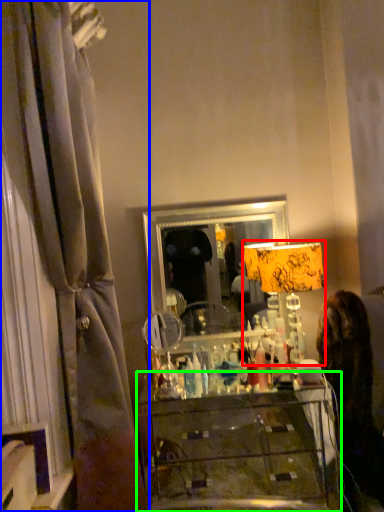
Question: Which object is positioned closest to table lamp (highlighted by a red box)? Select from curtain (highlighted by a blue box) and furniture (highlighted by a green box).

Choices:
 (A) curtain
 (B) furniture

Answer: (B)